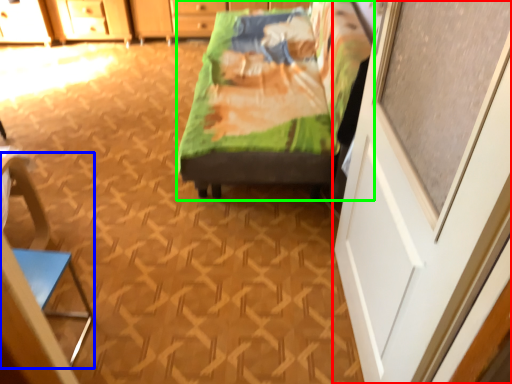
Question: Which is farther away from screen door (highlighted by a red box)? armchair (highlighted by a blue box) or furniture (highlighted by a green box)?

Choices:
 (A) armchair
 (B) furniture

Answer: (A)